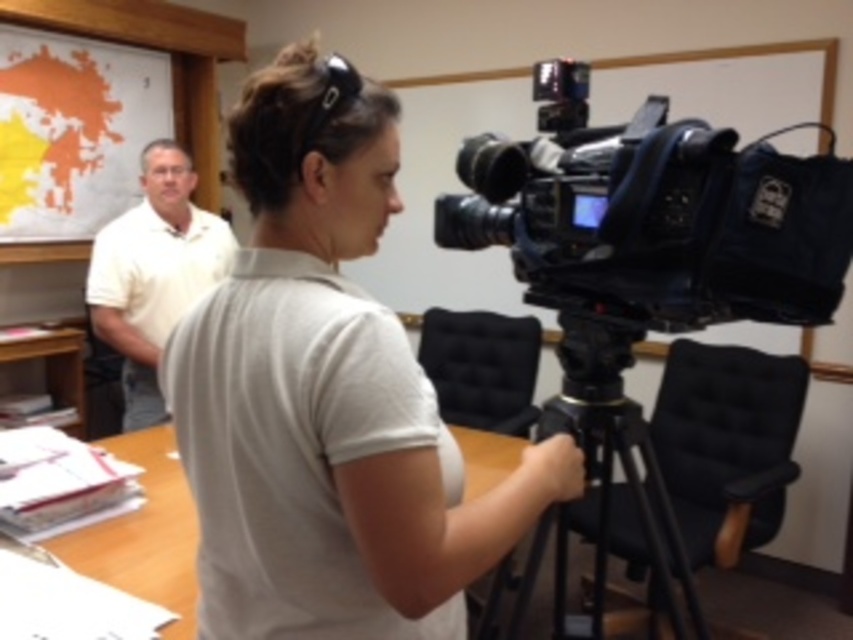
Question: Is black metal tripod at center below wooden table at center?

Choices:
 (A) yes
 (B) no

Answer: (A)

Question: Which of the following is the farthest from the observer?

Choices:
 (A) (641, 452)
 (B) (567, 212)
 (C) (821, 301)

Answer: (A)

Question: From the image, what is the correct spatial relationship of black plastic camera at center in relation to wooden table at center?

Choices:
 (A) left
 (B) right

Answer: (B)

Question: Which point is farther to the camera?

Choices:
 (A) wooden table at center
 (B) black plastic video camera at center

Answer: (A)

Question: Which of the following is the farthest from the observer?

Choices:
 (A) (180, 180)
 (B) (799, 275)
 (C) (640, 496)
 (D) (138, 433)

Answer: (A)

Question: Can you confirm if black plastic video camera at center is positioned above wooden table at center?

Choices:
 (A) no
 (B) yes

Answer: (B)